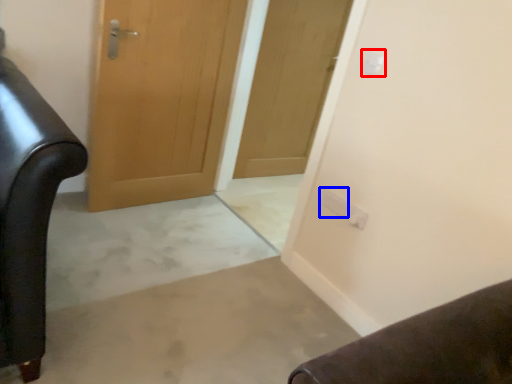
Question: Which of the following is the closest to the observer, electric outlet (highlighted by a red box) or electric outlet (highlighted by a blue box)?

Choices:
 (A) electric outlet
 (B) electric outlet

Answer: (A)